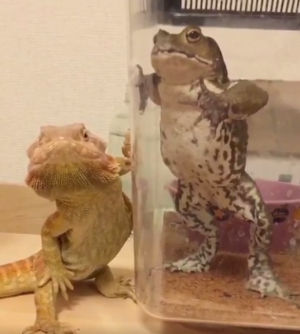
Image resolution: width=300 pixels, height=334 pixels. What are the coordinates of `pink water bowl` in the screenshot? It's located at (280, 191).